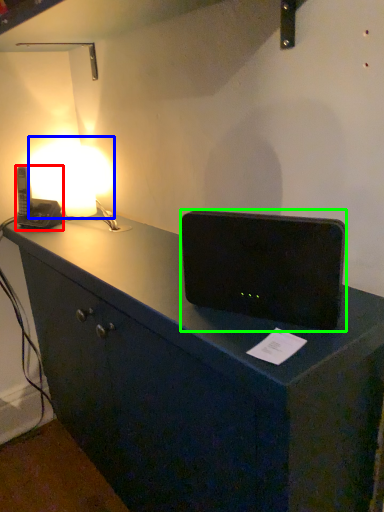
Question: Which is nearer to the gadget (highlighted by a red box)? lamp (highlighted by a blue box) or loudspeaker (highlighted by a green box).

Choices:
 (A) lamp
 (B) loudspeaker

Answer: (A)